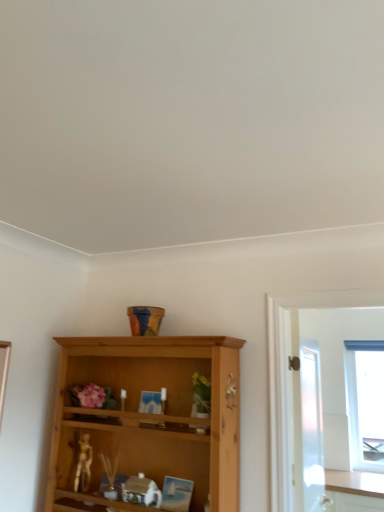
In order to click on white frosted glass screen door at right in this screenshot , I will do `click(302, 415)`.

Describe the element at coordinates (302, 415) in the screenshot. I see `white frosted glass screen door at right` at that location.

This screenshot has height=512, width=384. What are the coordinates of `metallic gold figurine at lower left` in the screenshot? It's located at (83, 464).

The image size is (384, 512). I want to click on screen door located in front of the transparent glass window at right, so click(302, 415).

Considering the positions of points (368, 389) and (296, 418), is point (368, 389) farther from camera compared to point (296, 418)?

Yes, point (368, 389) is farther from viewer.

Does transparent glass window at right appear on the right side of white frosted glass screen door at right?

Yes, transparent glass window at right is to the right of white frosted glass screen door at right.

Which is more to the right, transparent glass window at right or metallic gold figurine at lower left?

Positioned to the right is transparent glass window at right.

Is transparent glass window at right not near metallic gold figurine at lower left?

That's right, there is a large distance between transparent glass window at right and metallic gold figurine at lower left.

Is transparent glass window at right turned away from metallic gold figurine at lower left?

No.

Considering the relative sizes of transparent glass window at right and metallic gold figurine at lower left in the image provided, is transparent glass window at right wider than metallic gold figurine at lower left?

Indeed, transparent glass window at right has a greater width compared to metallic gold figurine at lower left.

Based on the photo, what's the angular difference between white frosted glass screen door at right and transparent glass window at right's facing directions?

The angle between the facing direction of white frosted glass screen door at right and the facing direction of transparent glass window at right is 93.9 degrees.

Is white frosted glass screen door at right further to camera compared to transparent glass window at right?

No, it is in front of transparent glass window at right.

Is white frosted glass screen door at right far away from transparent glass window at right?

white frosted glass screen door at right is positioned a significant distance from transparent glass window at right.

From their relative heights in the image, would you say white frosted glass screen door at right is taller or shorter than transparent glass window at right?

Considering their sizes, white frosted glass screen door at right has less height than transparent glass window at right.

Where is `screen door positioned vertically above the metallic gold figurine at lower left (from a real-world perspective)`? The width and height of the screenshot is (384, 512). screen door positioned vertically above the metallic gold figurine at lower left (from a real-world perspective) is located at coordinates (302, 415).

Is metallic gold figurine at lower left situated inside white frosted glass screen door at right or outside?

metallic gold figurine at lower left is not enclosed by white frosted glass screen door at right.

From a real-world perspective, between metallic gold figurine at lower left and white frosted glass screen door at right, who is vertically lower?

metallic gold figurine at lower left, from a real-world perspective.

From the picture: In terms of height, does metallic gold figurine at lower left look taller or shorter compared to white frosted glass screen door at right?

Considering their sizes, metallic gold figurine at lower left has less height than white frosted glass screen door at right.

How far apart are metallic gold figurine at lower left and transparent glass window at right?

2.71 meters.

From the picture: Considering the sizes of objects metallic gold figurine at lower left and transparent glass window at right in the image provided, who is smaller, metallic gold figurine at lower left or transparent glass window at right?

metallic gold figurine at lower left.

Is point (85, 489) positioned in front of point (368, 402)?

Yes, it is.

Considering the sizes of objects white frosted glass screen door at right and metallic gold figurine at lower left in the image provided, who is shorter, white frosted glass screen door at right or metallic gold figurine at lower left?

With less height is metallic gold figurine at lower left.

Does white frosted glass screen door at right turn towards metallic gold figurine at lower left?

No, white frosted glass screen door at right is not aimed at metallic gold figurine at lower left.

From the picture: Is white frosted glass screen door at right bigger than metallic gold figurine at lower left?

Yes, white frosted glass screen door at right is bigger than metallic gold figurine at lower left.

Measure the distance from white frosted glass screen door at right to metallic gold figurine at lower left.

white frosted glass screen door at right and metallic gold figurine at lower left are 3.84 feet apart from each other.

This screenshot has width=384, height=512. Find the location of `window below the white frosted glass screen door at right (from the image's perspective)`. window below the white frosted glass screen door at right (from the image's perspective) is located at coordinates coord(366,401).

Locate an element on the screen. The image size is (384, 512). miniature that appears below the transparent glass window at right (from a real-world perspective) is located at coordinates (83, 464).

From the image, which object appears to be farther from metallic gold figurine at lower left, transparent glass window at right or white frosted glass screen door at right?

Based on the image, transparent glass window at right appears to be further to metallic gold figurine at lower left.

When comparing their distances from transparent glass window at right, does white frosted glass screen door at right or metallic gold figurine at lower left seem further?

metallic gold figurine at lower left is positioned further to the anchor transparent glass window at right.

Looking at the image, which one is located closer to white frosted glass screen door at right, metallic gold figurine at lower left or transparent glass window at right?

transparent glass window at right is positioned closer to the anchor white frosted glass screen door at right.

Estimate the real-world distances between objects in this image. Which object is further from metallic gold figurine at lower left, white frosted glass screen door at right or transparent glass window at right?

transparent glass window at right lies further to metallic gold figurine at lower left than the other object.

Which object lies further to the anchor point white frosted glass screen door at right, transparent glass window at right or metallic gold figurine at lower left?

metallic gold figurine at lower left.

Looking at the image, which one is located further to transparent glass window at right, metallic gold figurine at lower left or white frosted glass screen door at right?

metallic gold figurine at lower left is further to transparent glass window at right.

The height and width of the screenshot is (512, 384). I want to click on screen door between metallic gold figurine at lower left and transparent glass window at right from left to right, so click(x=302, y=415).